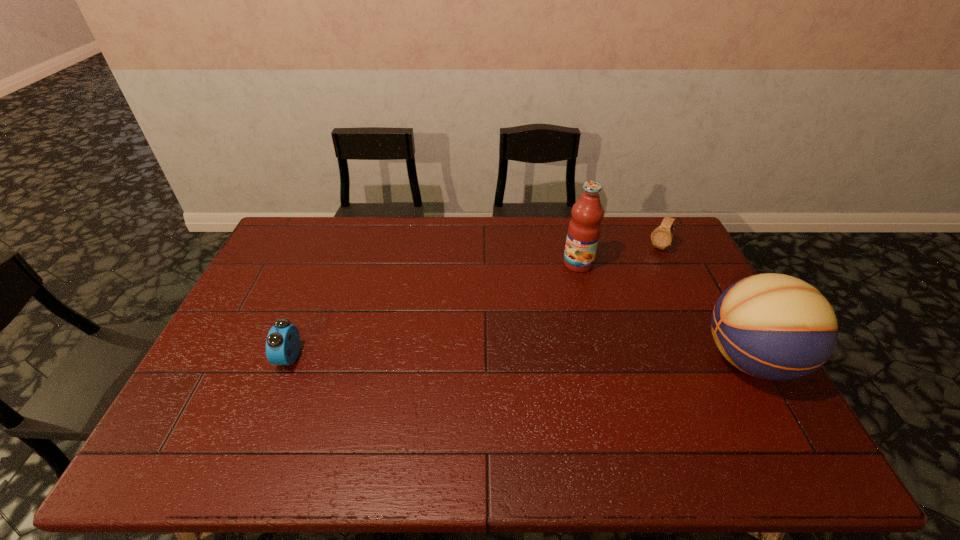
Identify the location of vacant space located 0.370m on the front label of the fruit juice. The image size is (960, 540). coord(500,335).

Find the location of a particular element. This screenshot has width=960, height=540. vacant space located 0.070m on the front label of the fruit juice is located at coordinates (558, 282).

Identify the location of vacant region located 0.060m on the front label of the fruit juice. (560, 280).

Where is `free spot located 0.280m on the face of the watch`? This screenshot has height=540, width=960. free spot located 0.280m on the face of the watch is located at coordinates (622, 300).

Where is `free spot located 0.270m on the face of the watch`? The width and height of the screenshot is (960, 540). free spot located 0.270m on the face of the watch is located at coordinates (623, 298).

In order to click on vacant space located on the face of the watch in this screenshot , I will do `click(645, 268)`.

Identify the location of fruit juice present at the far edge. (584, 229).

Locate an element on the screen. This screenshot has height=540, width=960. watch that is at the far edge is located at coordinates (661, 237).

Where is `object that is at the near edge`? The width and height of the screenshot is (960, 540). object that is at the near edge is located at coordinates (772, 326).

At what (x,y) coordinates should I click in order to perform the action: click on basketball located in the right edge section of the desktop. Please return your answer as a coordinate pair (x, y). Image resolution: width=960 pixels, height=540 pixels. Looking at the image, I should click on (772, 326).